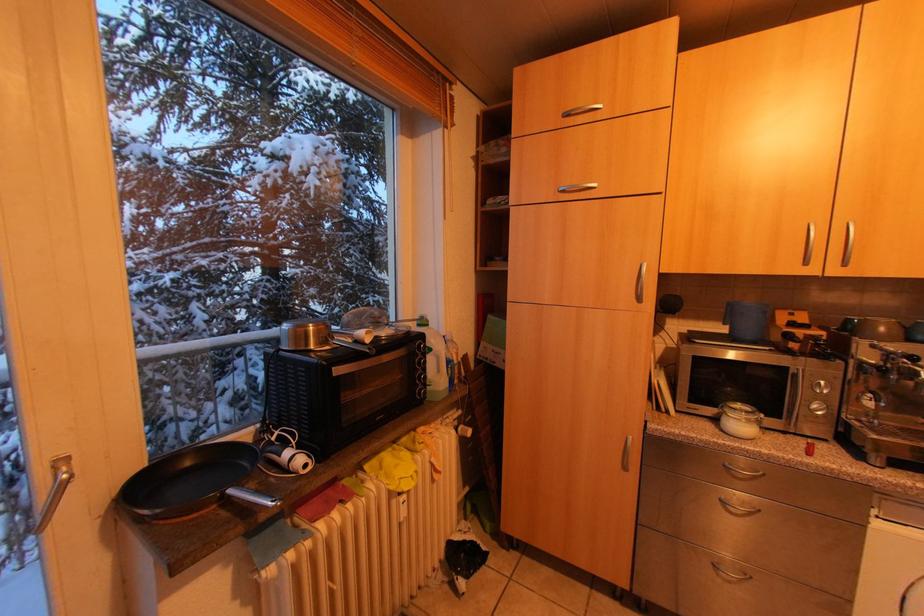
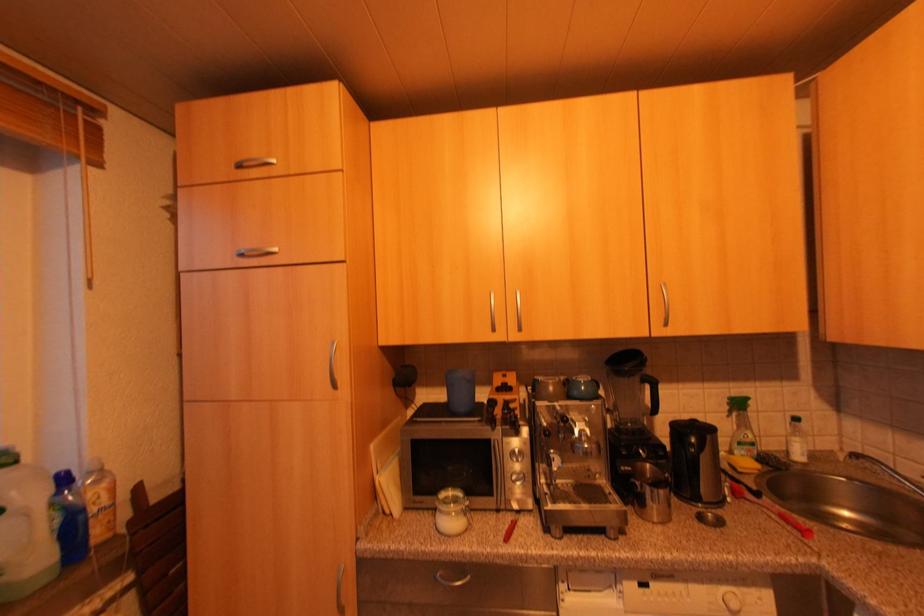
Question: The images are taken continuously from a first-person perspective. In which direction is your viewpoint rotating?

Choices:
 (A) Left
 (B) Right
 (C) Up
 (D) Down

Answer: (B)